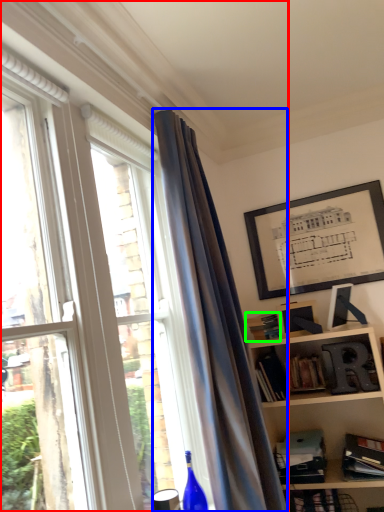
Question: Estimate the real-world distances between objects in this image. Which object is closer to window (highlighted by a red box), curtain (highlighted by a blue box) or paperback book (highlighted by a green box)?

Choices:
 (A) curtain
 (B) paperback book

Answer: (A)